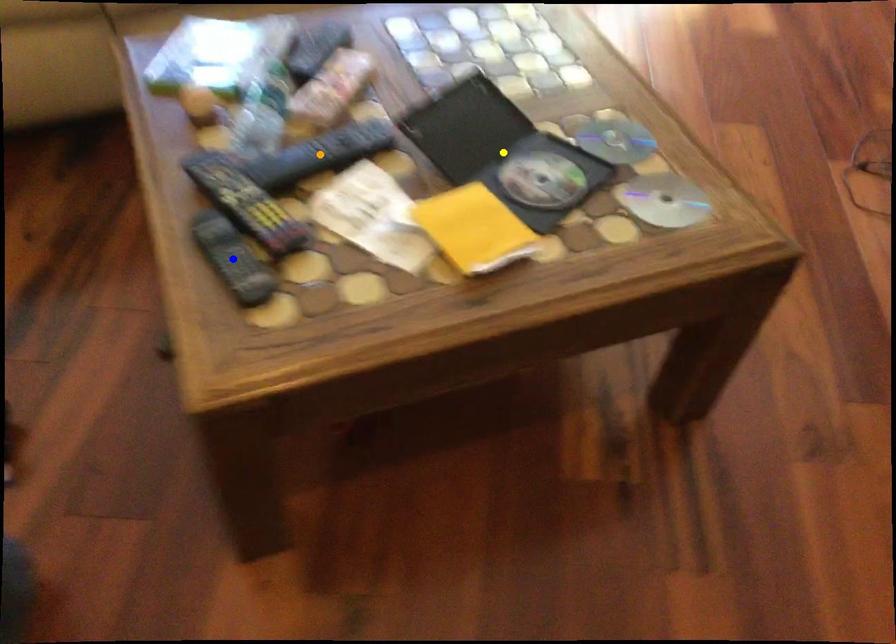
Order these from nearest to farthest:
yellow point
blue point
orange point

blue point < orange point < yellow point